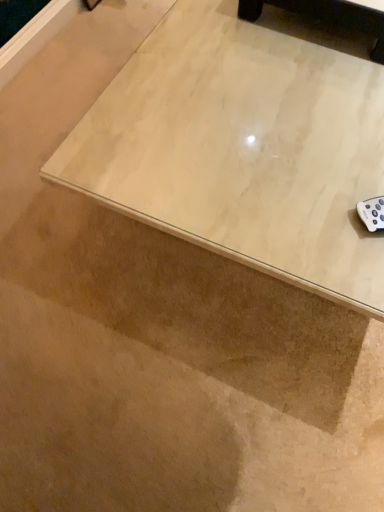
Where is `light wood table at upper right`? The image size is (384, 512). light wood table at upper right is located at coordinates (244, 146).

What do you see at coordinates (244, 146) in the screenshot? This screenshot has height=512, width=384. I see `light wood table at upper right` at bounding box center [244, 146].

This screenshot has width=384, height=512. Find the location of `light wood coffee table at upper center`. light wood coffee table at upper center is located at coordinates (328, 17).

Describe the element at coordinates (328, 17) in the screenshot. This screenshot has width=384, height=512. I see `light wood coffee table at upper center` at that location.

Identify the location of light wood table at upper right. (244, 146).

Based on the photo, which object is positioned more to the right, light wood coffee table at upper center or light wood table at upper right?

light wood table at upper right is more to the right.

Which object is closer to the camera taking this photo, light wood coffee table at upper center or light wood table at upper right?

light wood table at upper right is closer to the camera.

Which is in front, point (303, 6) or point (173, 75)?

Positioned in front is point (173, 75).

From the image's perspective, is light wood coffee table at upper center located beneath light wood table at upper right?

No.

From a real-world perspective, which is physically above, light wood coffee table at upper center or light wood table at upper right?

light wood coffee table at upper center.

Can you confirm if light wood coffee table at upper center is wider than light wood table at upper right?

No, light wood coffee table at upper center is not wider than light wood table at upper right.

Based on the photo, considering the sizes of light wood coffee table at upper center and light wood table at upper right in the image, is light wood coffee table at upper center taller or shorter than light wood table at upper right?

Result: Clearly, light wood coffee table at upper center is shorter compared to light wood table at upper right.

Considering the relative sizes of light wood coffee table at upper center and light wood table at upper right in the image provided, is light wood coffee table at upper center smaller than light wood table at upper right?

Yes.

Is light wood coffee table at upper center situated inside light wood table at upper right or outside?

light wood coffee table at upper center is outside light wood table at upper right.

Can you see light wood coffee table at upper center touching light wood table at upper right?

No, light wood coffee table at upper center is not touching light wood table at upper right.

Is light wood coffee table at upper center facing towards light wood table at upper right?

No, light wood coffee table at upper center is not facing towards light wood table at upper right.

How many degrees apart are the facing directions of light wood coffee table at upper center and light wood table at upper right?

The facing directions of light wood coffee table at upper center and light wood table at upper right are 2.5 degrees apart.

Where is `table in front of the light wood coffee table at upper center`? The width and height of the screenshot is (384, 512). table in front of the light wood coffee table at upper center is located at coordinates (244, 146).

Which object is positioned more to the left, light wood table at upper right or light wood coffee table at upper center?

light wood coffee table at upper center is more to the left.

Which object is closer to the camera, light wood table at upper right or light wood coffee table at upper center?

light wood table at upper right.

Is point (242, 157) closer or farther from the camera than point (299, 9)?

Point (242, 157) appears to be closer to the viewer than point (299, 9).

From the image's perspective, is light wood table at upper right on light wood coffee table at upper center?

No, from the image's perspective, light wood table at upper right is not over light wood coffee table at upper center.

From a real-world perspective, is light wood table at upper right above or below light wood coffee table at upper center?

Clearly, from a real-world perspective, light wood table at upper right is below light wood coffee table at upper center.

Is light wood table at upper right wider than light wood coffee table at upper center?

Indeed, light wood table at upper right has a greater width compared to light wood coffee table at upper center.

Who is taller, light wood table at upper right or light wood coffee table at upper center?

Standing taller between the two is light wood table at upper right.

Considering the sizes of objects light wood table at upper right and light wood coffee table at upper center in the image provided, who is smaller, light wood table at upper right or light wood coffee table at upper center?

With smaller size is light wood coffee table at upper center.

Is light wood table at upper right spatially inside light wood coffee table at upper center, or outside of it?

light wood table at upper right cannot be found inside light wood coffee table at upper center.

Is light wood table at upper right far away from light wood coffee table at upper center?

They are positioned close to each other.

Could you tell me if light wood table at upper right is turned towards light wood coffee table at upper center?

No, light wood table at upper right is not facing towards light wood coffee table at upper center.

Locate an element on the screen. The height and width of the screenshot is (512, 384). table to the right of light wood coffee table at upper center is located at coordinates pyautogui.click(x=244, y=146).

Locate an element on the screen. table below the light wood coffee table at upper center (from the image's perspective) is located at coordinates tap(244, 146).

I want to click on furniture located above the light wood table at upper right (from a real-world perspective), so click(x=328, y=17).